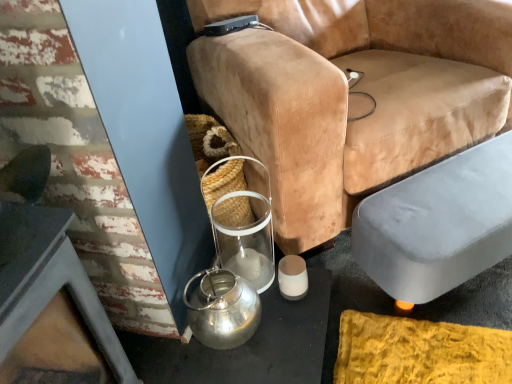
Question: Does velvet tan chair at center have a greater height compared to gray fabric ottoman at lower right?

Choices:
 (A) yes
 (B) no

Answer: (A)

Question: Would you say gray fabric ottoman at lower right is part of velvet tan chair at center's contents?

Choices:
 (A) yes
 (B) no

Answer: (B)

Question: From the image's perspective, would you say velvet tan chair at center is shown under gray fabric ottoman at lower right?

Choices:
 (A) no
 (B) yes

Answer: (A)

Question: Is velvet tan chair at center looking in the opposite direction of gray fabric ottoman at lower right?

Choices:
 (A) yes
 (B) no

Answer: (B)

Question: Is velvet tan chair at center not within gray fabric ottoman at lower right?

Choices:
 (A) yes
 (B) no

Answer: (A)

Question: From a real-world perspective, is velvet tan chair at center positioned under gray fabric ottoman at lower right based on gravity?

Choices:
 (A) yes
 (B) no

Answer: (B)

Question: Considering the relative sizes of velvet tan chair at center and shiny metallic kettle at lower left in the image provided, is velvet tan chair at center taller than shiny metallic kettle at lower left?

Choices:
 (A) yes
 (B) no

Answer: (A)

Question: Can you confirm if velvet tan chair at center is shorter than shiny metallic kettle at lower left?

Choices:
 (A) yes
 (B) no

Answer: (B)

Question: Can you confirm if velvet tan chair at center is thinner than shiny metallic kettle at lower left?

Choices:
 (A) yes
 (B) no

Answer: (B)

Question: Is velvet tan chair at center facing away from shiny metallic kettle at lower left?

Choices:
 (A) yes
 (B) no

Answer: (B)

Question: Is velvet tan chair at center wider than shiny metallic kettle at lower left?

Choices:
 (A) yes
 (B) no

Answer: (A)

Question: From a real-world perspective, is velvet tan chair at center located higher than shiny metallic kettle at lower left?

Choices:
 (A) no
 (B) yes

Answer: (B)

Question: Is gray fabric ottoman at lower right to the right of matte white candle at lower center from the viewer's perspective?

Choices:
 (A) yes
 (B) no

Answer: (A)